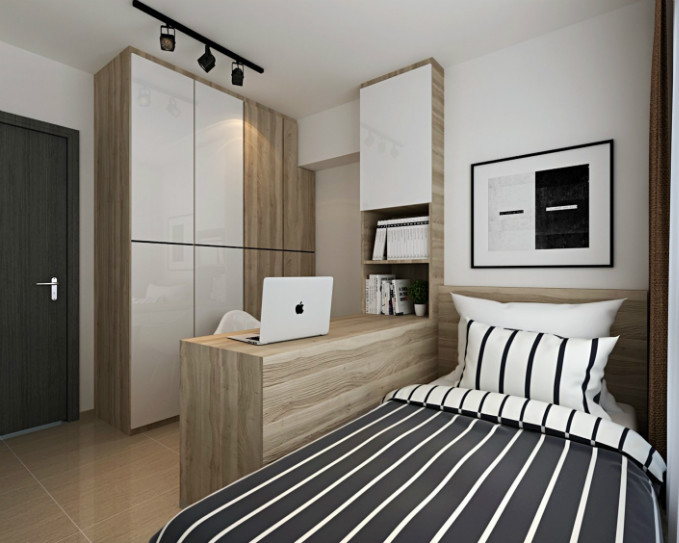
In order to click on books in this screenshot , I will do [x=403, y=295], [x=392, y=292], [x=381, y=292], [x=371, y=289].